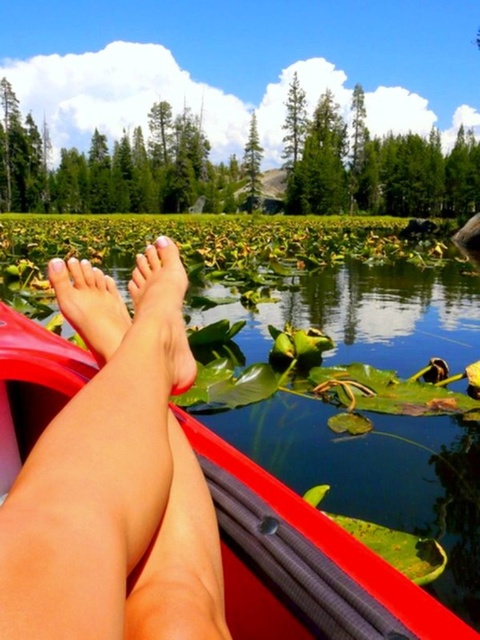
Question: Does pink matte feet at lower left have a larger size compared to smooth skin foot at center?

Choices:
 (A) yes
 (B) no

Answer: (A)

Question: Is rubberized red kayak at lower left thinner than pink matte feet at lower left?

Choices:
 (A) no
 (B) yes

Answer: (A)

Question: Is skinny legs at center smaller than smooth skin foot at center?

Choices:
 (A) no
 (B) yes

Answer: (A)

Question: Among these objects, which one is nearest to the camera?

Choices:
 (A) pink matte feet at lower center
 (B) skinny legs at center
 (C) pink matte feet at lower left

Answer: (B)

Question: Which of the following is the closest to the observer?

Choices:
 (A) smooth skin foot at center
 (B) skinny legs at center

Answer: (B)

Question: Which point is closer to the camera?

Choices:
 (A) (173, 328)
 (B) (113, 298)
 (C) (158, 284)
 (D) (156, 516)

Answer: (D)